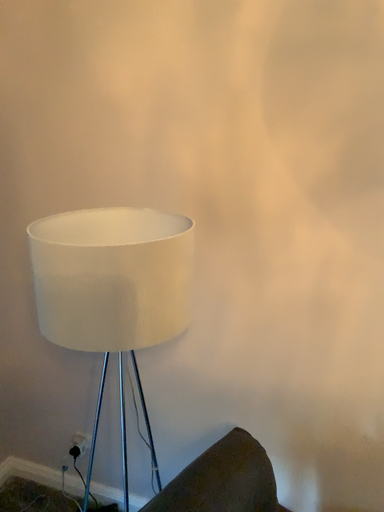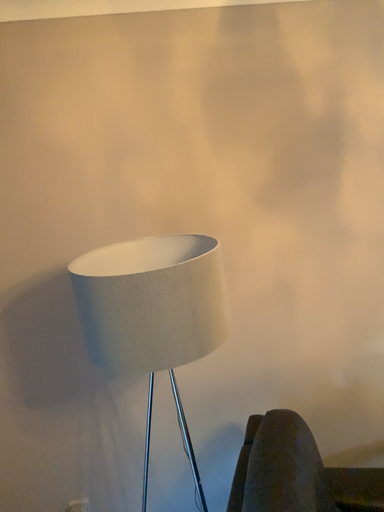
Question: How did the camera likely rotate when shooting the video?

Choices:
 (A) rotated downward
 (B) rotated upward

Answer: (B)